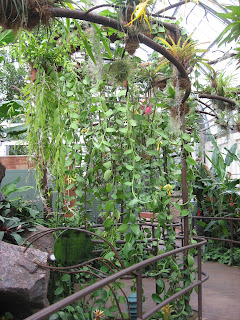
You are a GUI agent. You are given a task and a screenshot of the screen. Output one action in this format:
    pyautogui.click(x=<x>, y=<y>)
    Task: Click on the brick wall
    The height and width of the screenshot is (320, 240).
    Given the screenshot: What is the action you would take?
    (20, 159)